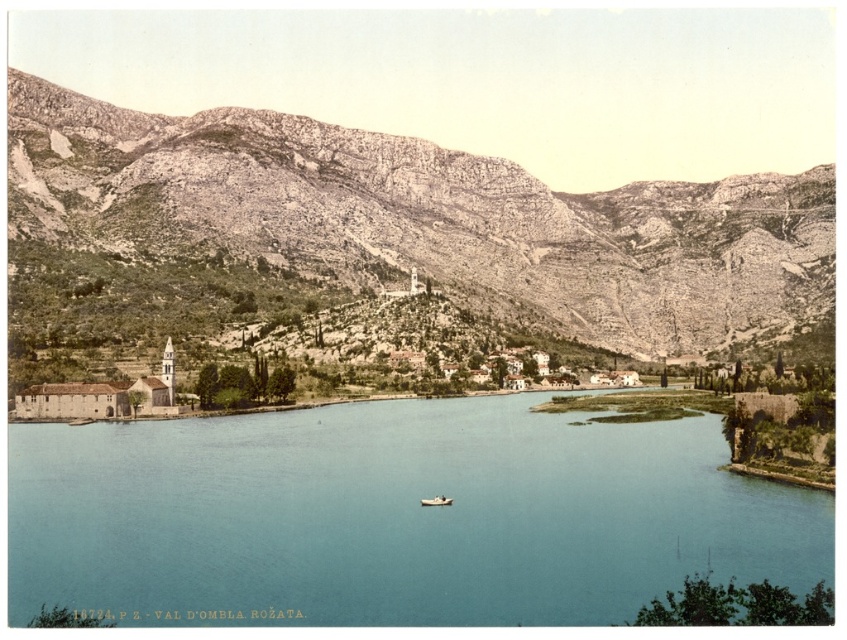
You are navigating a small boat and need to reach the blue water at center. Based on the coordinates provided, in which direction should you steer from your current position at point A located at the left side of the image?

Result: The blue water at center is located at coordinates point A is on the left side of the image, so you should steer towards the center of the image to reach the blue water at center.

You are planning to cross the valley using a bridge that is 10 meters wide. You see the blue water at center and the rugged stone mountain at center in the middle of the valley. Which one can the bridge span over without touching either side?

The blue water at center has a width less than the rugged stone mountain at center, so the bridge can span over the blue water at center since its width is narrower and the bridge is 10 meters wide.